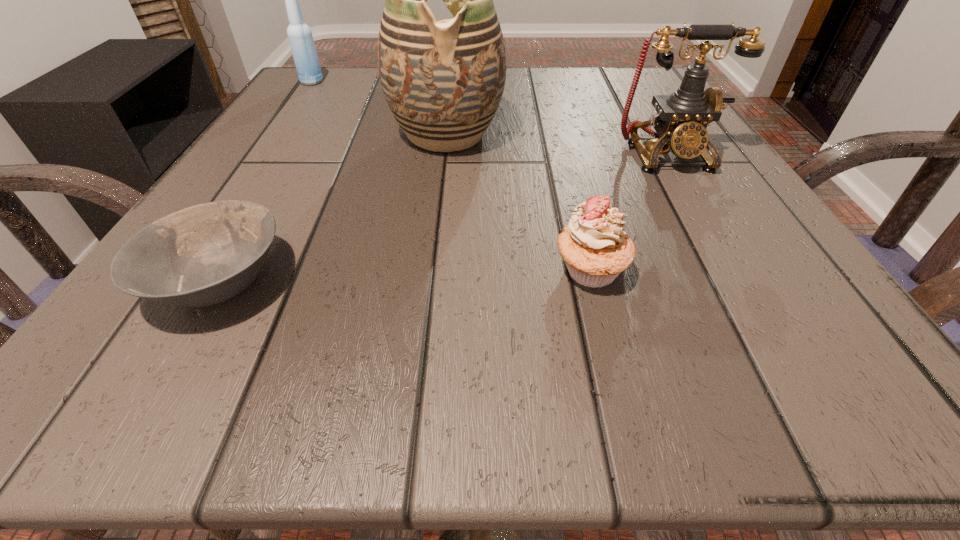
The width and height of the screenshot is (960, 540). I want to click on pottery, so click(x=443, y=81).

Image resolution: width=960 pixels, height=540 pixels. Identify the location of telephone. pos(681,121).

This screenshot has width=960, height=540. I want to click on the farthest object, so click(x=300, y=37).

Locate an element on the screen. cupcake is located at coordinates [595, 248].

Where is `the second shortest object`? Image resolution: width=960 pixels, height=540 pixels. the second shortest object is located at coordinates (595, 248).

This screenshot has width=960, height=540. I want to click on the shortest object, so tap(202, 255).

Find the location of a particular element. This screenshot has height=540, width=960. free space located 0.060m on the left of the third object from left to right is located at coordinates (354, 135).

In order to click on vacant space located on the front of the telephone, featuring the rotary dial in this screenshot , I will do `click(762, 320)`.

Identify the location of free space located 0.370m on the front of the bottle. (240, 188).

At what (x,y) coordinates should I click in order to perform the action: click on vacant point located on the back of the cupcake. Please return your answer as a coordinate pair (x, y). The width and height of the screenshot is (960, 540). Looking at the image, I should click on (552, 117).